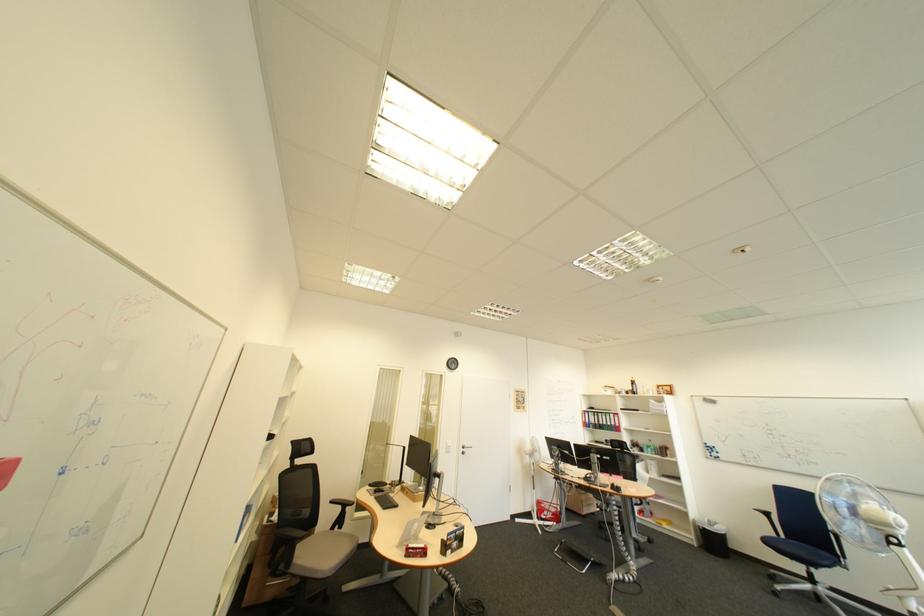
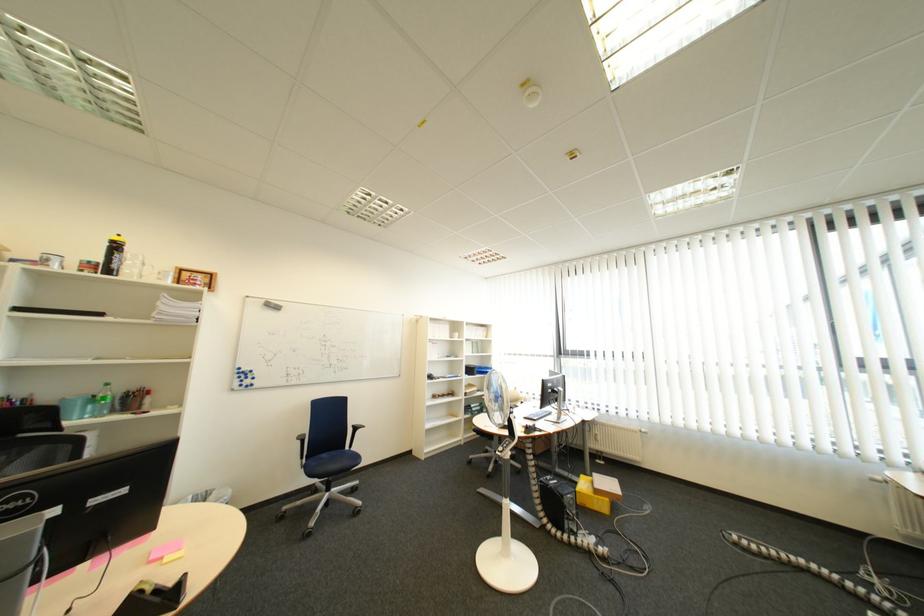
The point at (661, 448) is marked in the first image. Where is the corresponding point in the second image?

(105, 400)